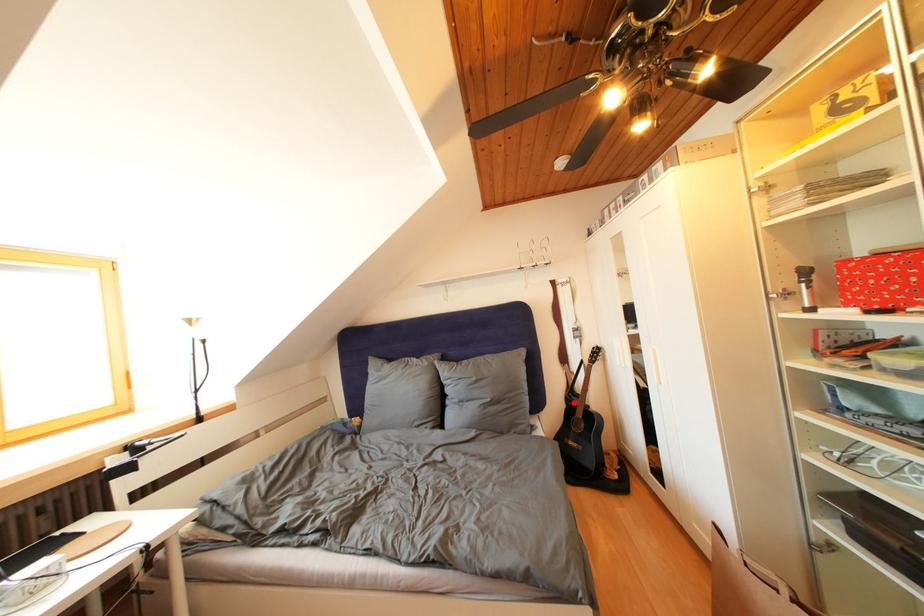
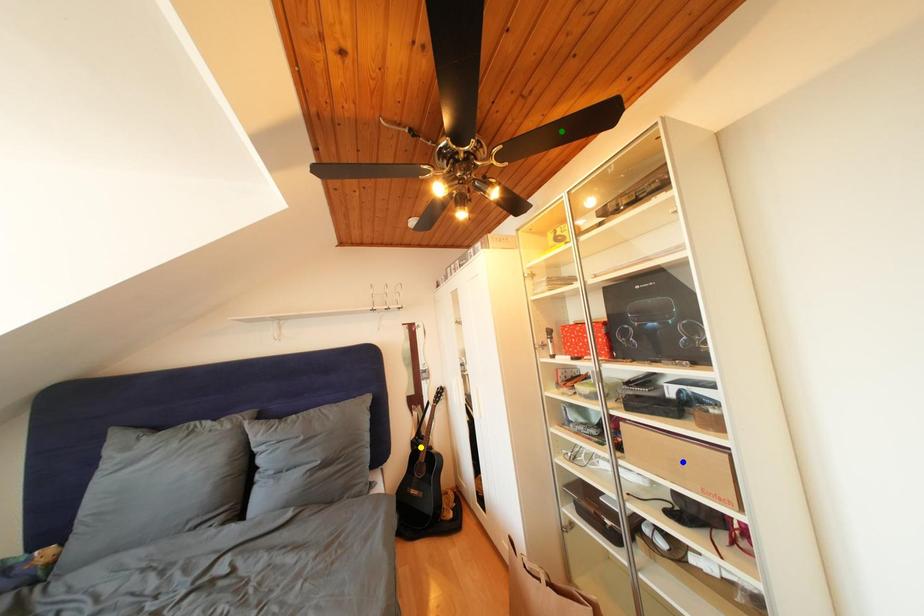
Question: I am providing you with two images of the same scene from different viewpoints. A red point is marked on the first image. You are given multiple points on the second image. Which point in image 2 is actually the same real-world point as the red point in image 1?

Choices:
 (A) yellow point
 (B) blue point
 (C) green point

Answer: (A)